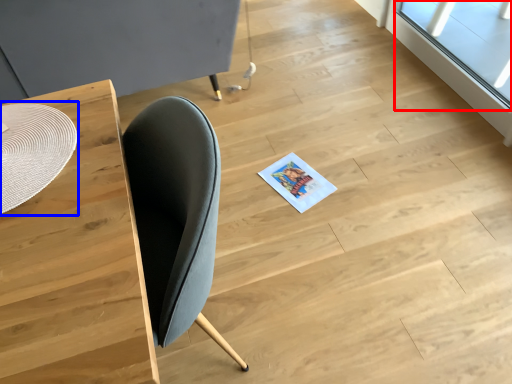
Question: Which object is closer to the camera taking this photo, window (highlighted by a red box) or round table (highlighted by a blue box)?

Choices:
 (A) window
 (B) round table

Answer: (B)